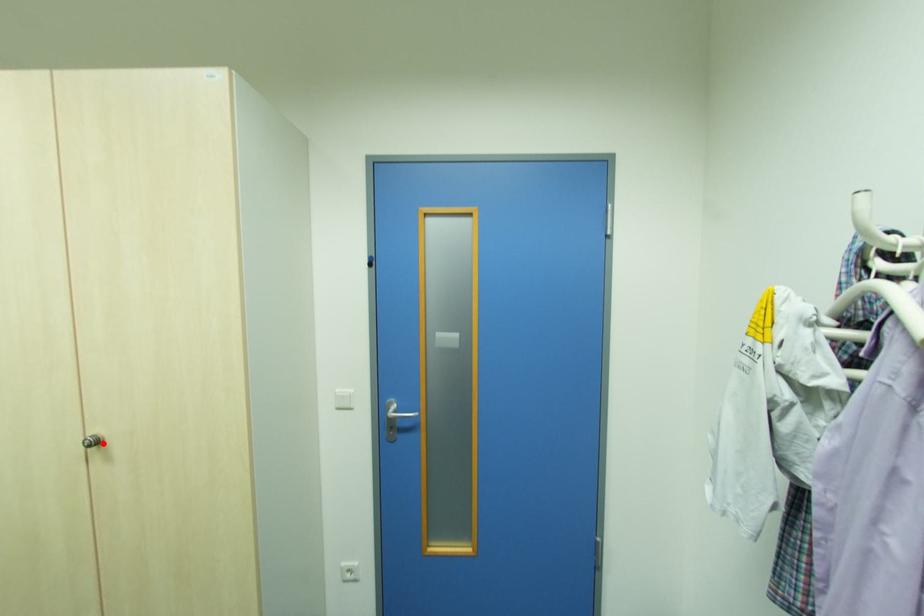
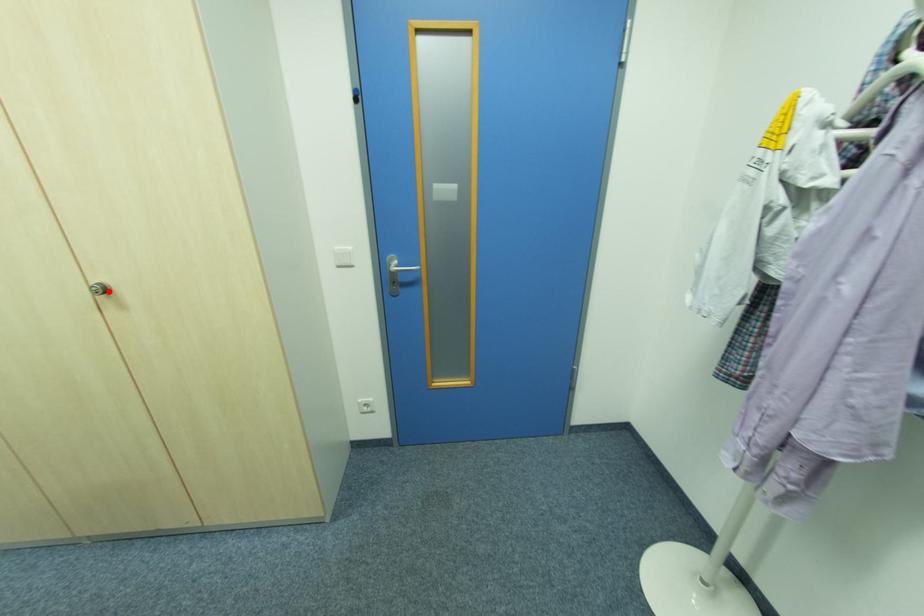
I am providing you with two images of the same scene from different viewpoints. A red point is marked on the first image and another point is marked on the second image. Is the red point in image1 aligned with the point shown in image2?

Yes